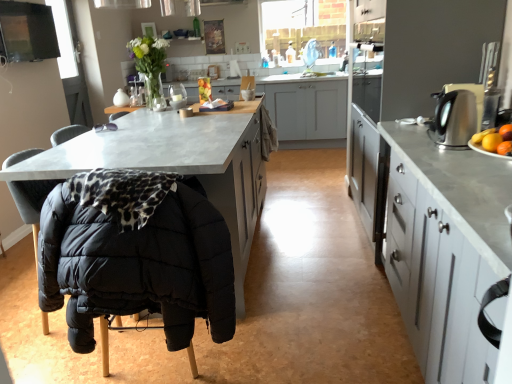
The image size is (512, 384). I want to click on free region on the left part of satin silver kettle at right, so click(x=412, y=147).